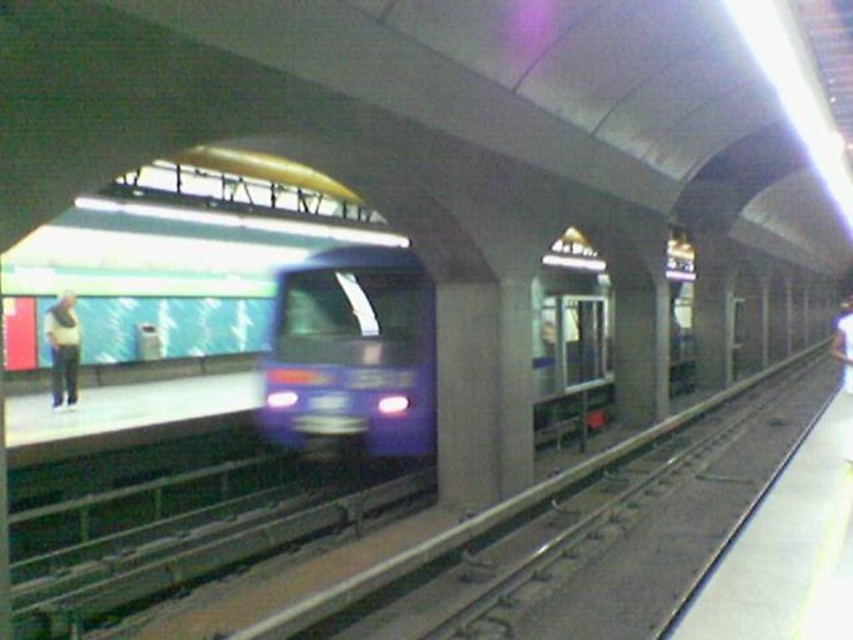
You are a delivery robot in a subway station. You need to deliver a package to a person wearing a white matte shirt at center. There is an obstacle, a light brown leather jacket at left, blocking your path. The jacket is 1.5 meters wide. Can you navigate around the obstacle to reach the person?

The light brown leather jacket at left and white matte shirt at center are 13.55 meters apart. Since the jacket is only 1.5 meters wide, there is sufficient space around it to navigate towards the white matte shirt at center. Yes, the robot can go around the obstacle.

You are a passenger waiting at the subway station. You notice the blue glossy train at center and the white matte shirt at center. Which object is closer to you?

The white matte shirt at center is closer to you because the blue glossy train at center is positioned under it, indicating the shirt is above the train and thus nearer.

You are a passenger waiting at the subway station. You notice a person standing near the edge of the platform wearing a white shirt and dark pants. There is also a point marked at coordinates (62, 349) on the light brown leather jacket at left. Can you determine if the light brown leather jacket at left is closer to the train or the platform edge?

The point (62, 349) on the light brown leather jacket at left is located closer to the platform edge than the train, so the light brown leather jacket at left is closer to the platform edge.